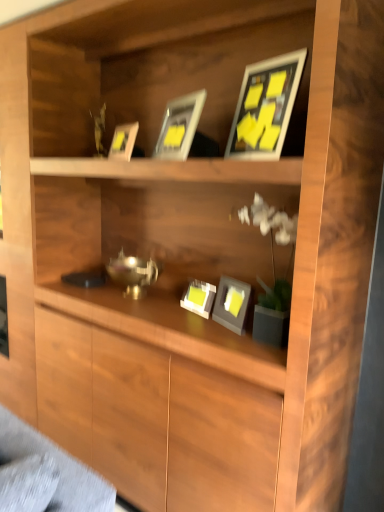
Question: Does point (180, 141) appear closer or farther from the camera than point (225, 292)?

Choices:
 (A) farther
 (B) closer

Answer: (B)

Question: Is matte silver picture frame at upper center, which is counted as the 1th picture frame, starting from the top, inside the boundaries of matte gray picture frame at center, the fourth picture frame from the top, or outside?

Choices:
 (A) outside
 (B) inside

Answer: (A)

Question: Estimate the real-world distances between objects in this image. Which object is farther from the matte gray picture frame at center, placed as the first picture frame when sorted from bottom to top?

Choices:
 (A) matte silver picture frame at upper center, which is counted as the 1th picture frame, starting from the top
 (B) matte black picture frame at upper center, positioned as the fourth picture frame in bottom-to-top order
 (C) matte gold picture frame at upper center, placed as the 3th picture frame when sorted from bottom to top
 (D) matte gray picture frame at center, the fourth picture frame from the top

Answer: (C)

Question: Considering the real-world distances, which object is closest to the matte gray picture frame at center, which ranks as the fifth picture frame in top-to-bottom order?

Choices:
 (A) matte black picture frame at upper center, positioned as the fourth picture frame in bottom-to-top order
 (B) matte gold picture frame at upper center, which appears as the third picture frame when viewed from the top
 (C) matte silver picture frame at upper center, which is counted as the 1th picture frame, starting from the top
 (D) matte gray picture frame at center, the fourth picture frame from the top

Answer: (D)